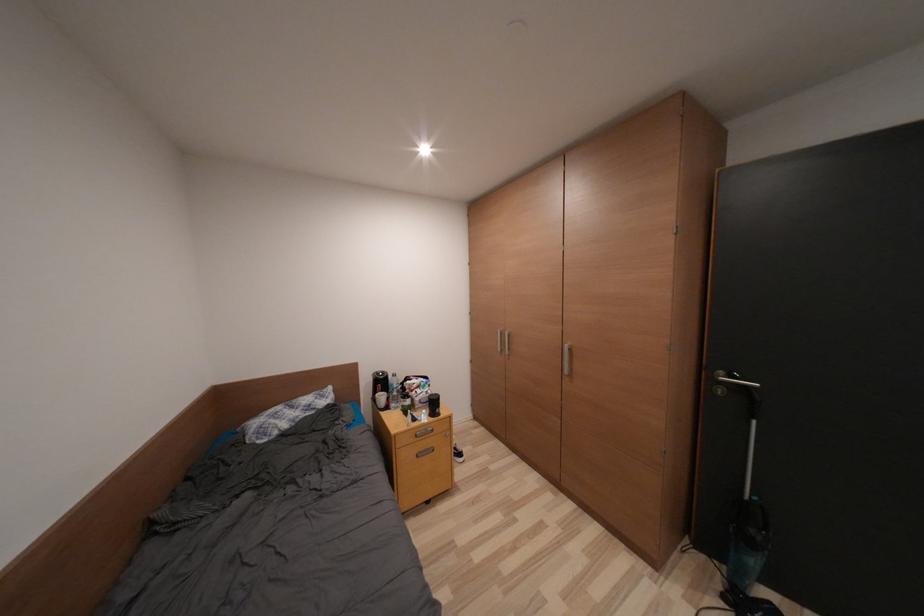
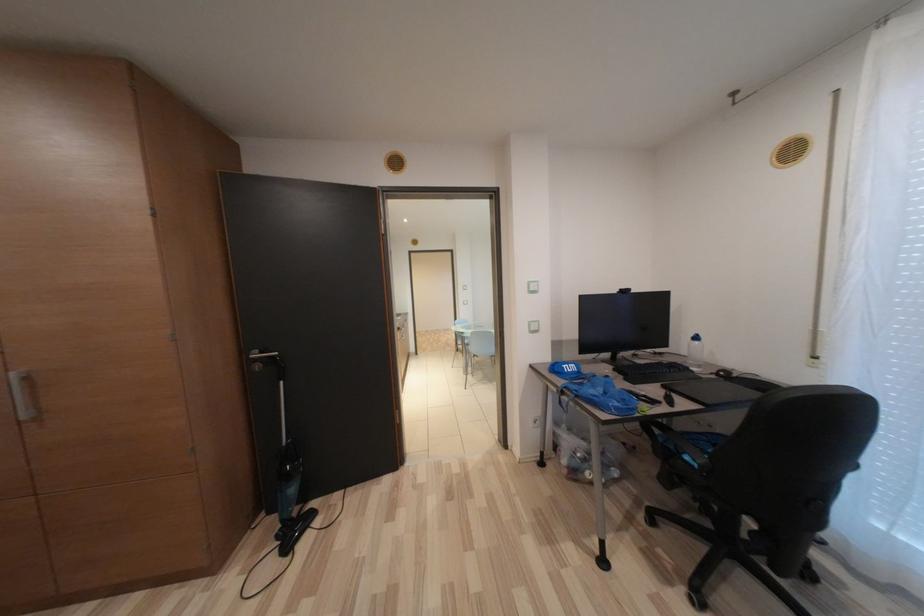
Question: The camera is either moving clockwise (left) or counter-clockwise (right) around the object. The first image is from the beginning of the video and the second image is from the end. Is the camera moving left or right when shooting the video?

Choices:
 (A) Left
 (B) Right

Answer: (A)